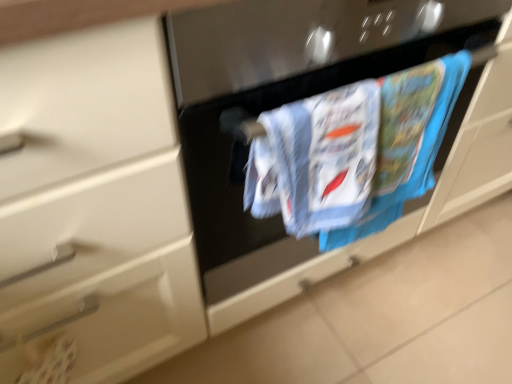
Question: From the image's perspective, is printed cotton towel at center located above or below white plastic door handle at lower left?

Choices:
 (A) below
 (B) above

Answer: (B)

Question: Based on their positions, is printed cotton towel at center located to the left or right of white plastic door handle at lower left?

Choices:
 (A) right
 (B) left

Answer: (A)

Question: Relative to white plastic door handle at lower left, is printed cotton towel at center in front or behind?

Choices:
 (A) behind
 (B) front

Answer: (B)

Question: Does point (89, 304) appear closer or farther from the camera than point (385, 165)?

Choices:
 (A) closer
 (B) farther

Answer: (A)

Question: Visually, is white plastic door handle at lower left positioned to the left or to the right of printed cotton towel at center?

Choices:
 (A) left
 (B) right

Answer: (A)

Question: From the image's perspective, is white plastic door handle at lower left located above or below printed cotton towel at center?

Choices:
 (A) below
 (B) above

Answer: (A)

Question: Is white plastic door handle at lower left taller or shorter than printed cotton towel at center?

Choices:
 (A) short
 (B) tall

Answer: (A)